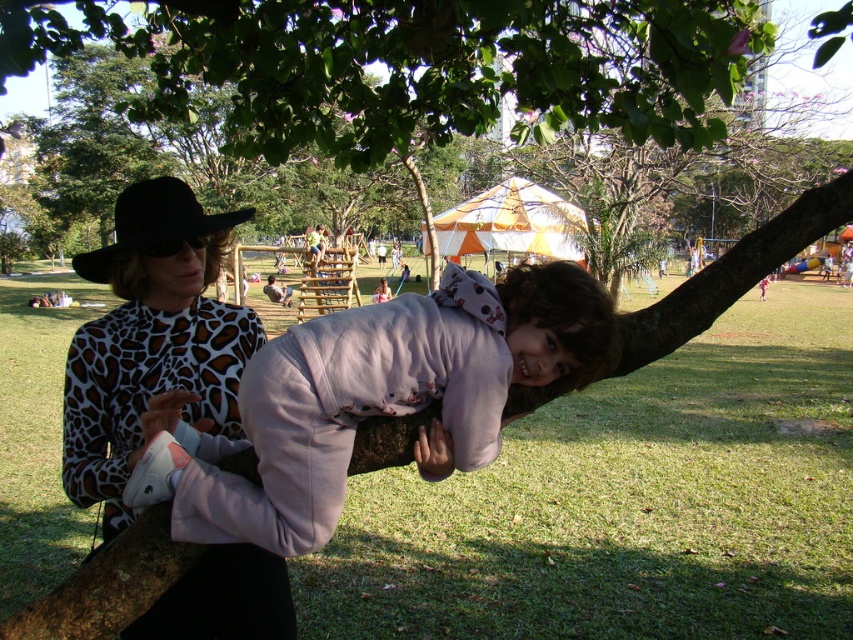
Question: Is the position of printed fabric sweater at center more distant than that of brown rough tree branch at center?

Choices:
 (A) no
 (B) yes

Answer: (B)

Question: Considering the relative positions of pale pink fleece at center and brown rough tree branch at center in the image provided, where is pale pink fleece at center located with respect to brown rough tree branch at center?

Choices:
 (A) right
 (B) left

Answer: (B)

Question: Which object is the farthest from the brown rough tree branch at center?

Choices:
 (A) printed fabric sweater at center
 (B) pale pink fleece at center

Answer: (A)

Question: Which object appears closest to the camera in this image?

Choices:
 (A) pale pink fleece at center
 (B) printed fabric sweater at center
 (C) brown rough tree branch at center

Answer: (A)

Question: Observing the image, what is the correct spatial positioning of pale pink fleece at center in reference to printed fabric sweater at center?

Choices:
 (A) below
 (B) above

Answer: (A)

Question: Which of these objects is positioned closest to the brown rough tree branch at center?

Choices:
 (A) pale pink fleece at center
 (B) printed fabric sweater at center

Answer: (A)